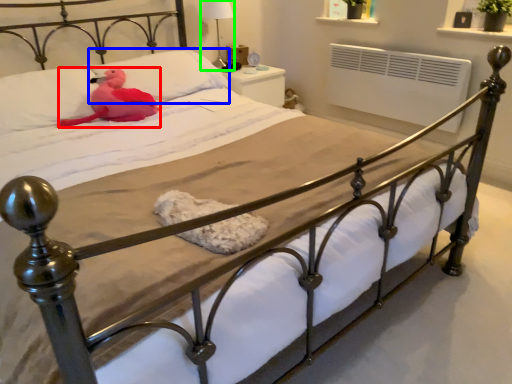
Question: Considering the real-world distances, which object is farthest from animal (highlighted by a red box)? pillow (highlighted by a blue box) or table lamp (highlighted by a green box)?

Choices:
 (A) pillow
 (B) table lamp

Answer: (B)